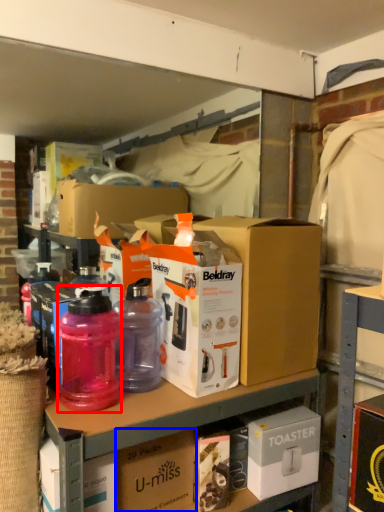
Question: Which of the following is the farthest to the observer, bottle (highlighted by a red box) or box (highlighted by a blue box)?

Choices:
 (A) bottle
 (B) box

Answer: (B)